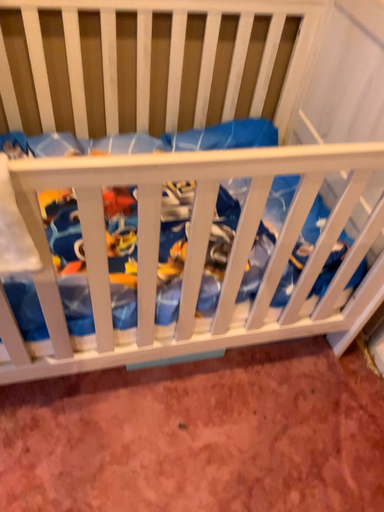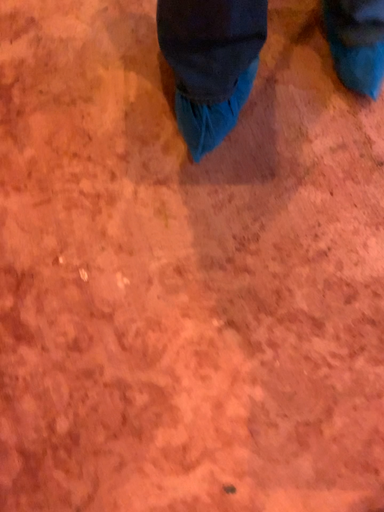
Question: Which way did the camera rotate in the video?

Choices:
 (A) rotated upward
 (B) rotated downward

Answer: (A)